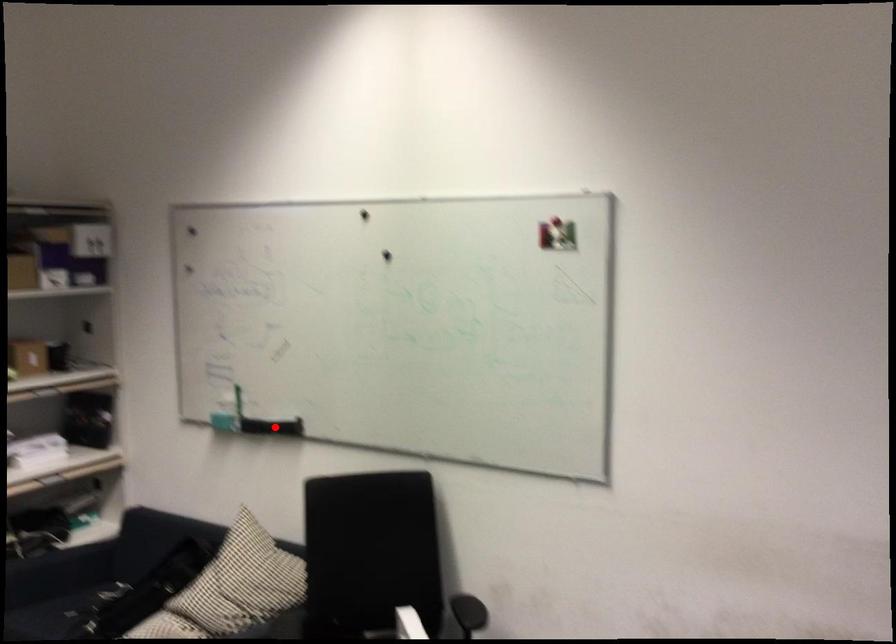
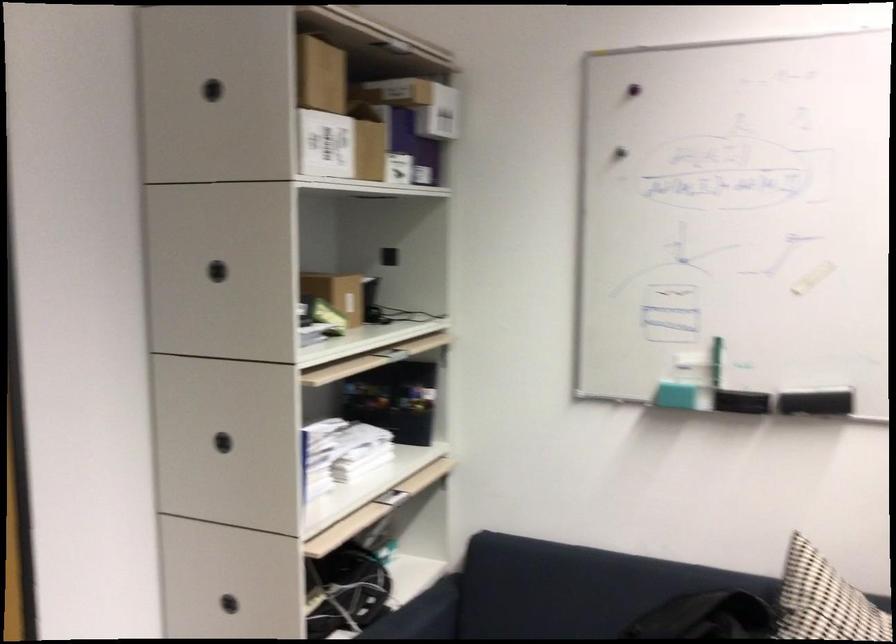
Question: I am providing you with two images of the same scene from different viewpoints. In image1, a red point is highlighted. Considering the same 3D point in image2, which of the following is correct?

Choices:
 (A) It is closer
 (B) It is farther

Answer: (A)